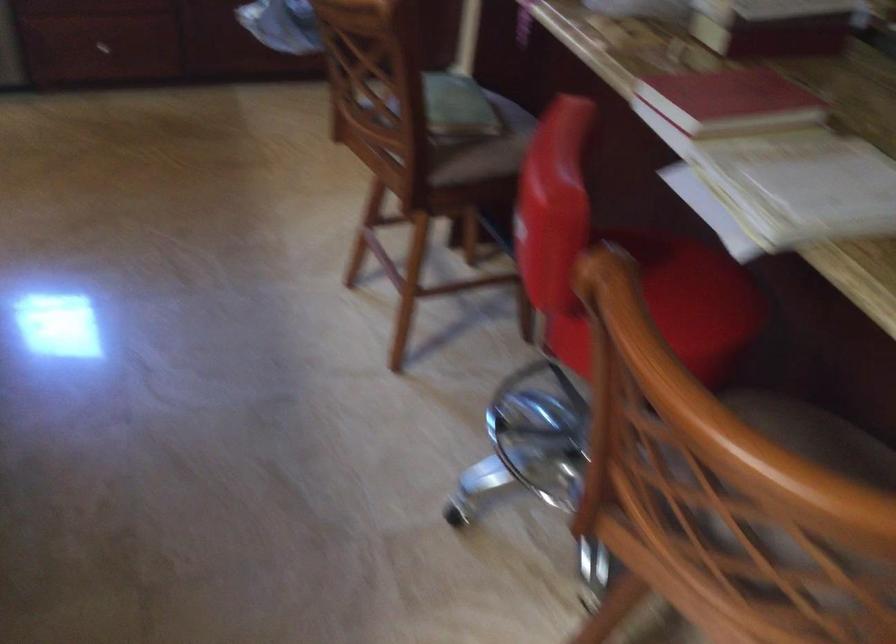
Describe the element at coordinates (98, 52) in the screenshot. Image resolution: width=896 pixels, height=644 pixels. I see `the silver drawer handle` at that location.